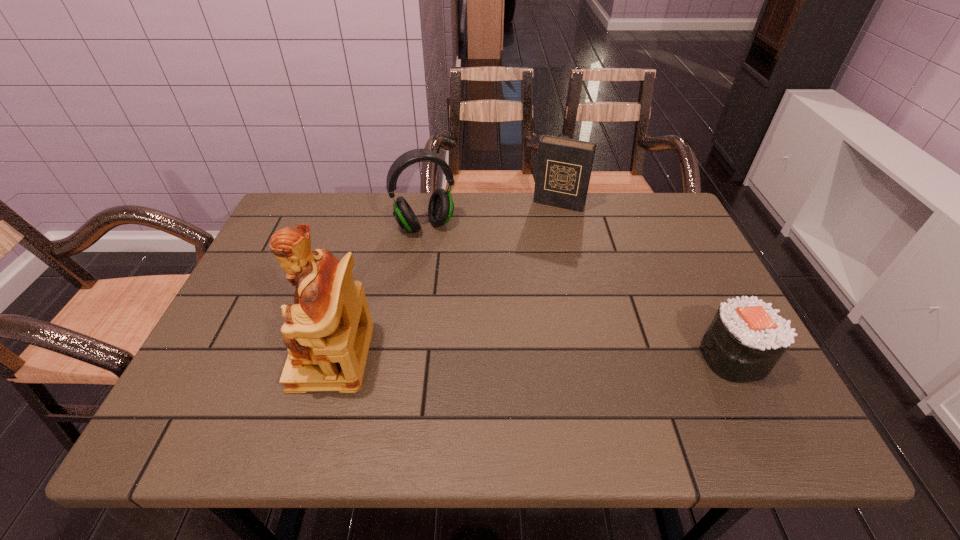
At what (x,y) coordinates should I click in order to perform the action: click on object that is positioned at the near right corner. Please return your answer as a coordinate pair (x, y). The height and width of the screenshot is (540, 960). Looking at the image, I should click on (746, 338).

In the image, there is a desktop. In order to click on free space at the far edge in this screenshot , I will do `click(425, 194)`.

In the image, there is a desktop. In order to click on vacant space at the near edge in this screenshot , I will do `click(441, 385)`.

Find the location of a particular element. The image size is (960, 540). vacant space at the left edge is located at coordinates (283, 301).

Where is `vacant space at the right edge of the desktop`? vacant space at the right edge of the desktop is located at coordinates (697, 277).

In the image, there is a desktop. Identify the location of free space at the far left corner. This screenshot has height=540, width=960. (291, 210).

Locate an element on the screen. This screenshot has height=540, width=960. free space at the far right corner is located at coordinates (663, 235).

Locate an element on the screen. The image size is (960, 540). blank region between the rightmost object and the third object from left to right is located at coordinates (646, 280).

What are the coordinates of `empty location between the tallest object and the second object from right to left` in the screenshot? It's located at (445, 280).

Locate an element on the screen. unoccupied area between the shortest object and the figurine is located at coordinates (533, 356).